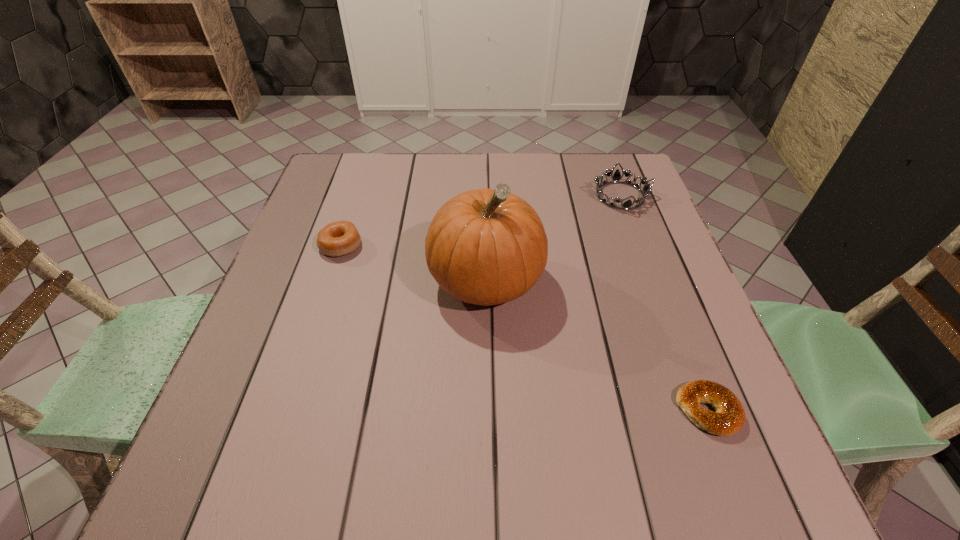
Identify the location of pumpkin. (486, 247).

Find the location of a particular element. The image size is (960, 540). the third object from right to left is located at coordinates (486, 247).

You are a GUI agent. You are given a task and a screenshot of the screen. Output one action in this format:
    pyautogui.click(x=<x>, y=<y>)
    Task: Click on the third shortest object
    This screenshot has height=540, width=960.
    Given the screenshot: What is the action you would take?
    pyautogui.click(x=616, y=177)

The height and width of the screenshot is (540, 960). I want to click on tiara, so click(616, 177).

This screenshot has width=960, height=540. In order to click on the farther bagel in this screenshot , I will do `click(339, 238)`.

Locate an element on the screen. Image resolution: width=960 pixels, height=540 pixels. the left bagel is located at coordinates (339, 238).

At what (x,y) coordinates should I click in order to perform the action: click on the nearest object. Please return your answer as a coordinate pair (x, y). The height and width of the screenshot is (540, 960). Looking at the image, I should click on (729, 418).

Locate an element on the screen. The image size is (960, 540). the shorter bagel is located at coordinates (729, 418).

Locate an element on the screen. This screenshot has height=540, width=960. free region located on the stem of the second object from left to right is located at coordinates (489, 468).

Locate an element on the screen. This screenshot has height=540, width=960. blank area located 0.110m on the front-facing side of the second tallest object is located at coordinates (550, 196).